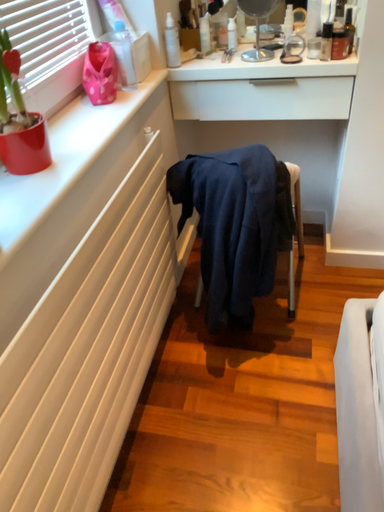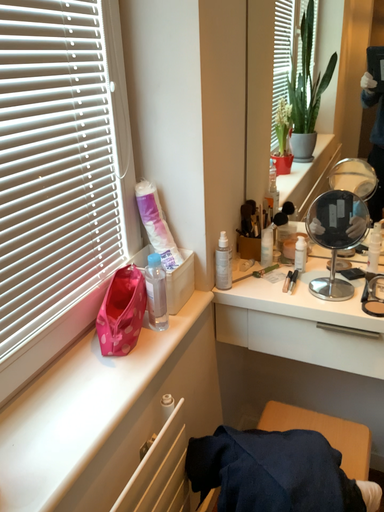
Question: Which way did the camera rotate in the video?

Choices:
 (A) rotated downward
 (B) rotated upward

Answer: (B)